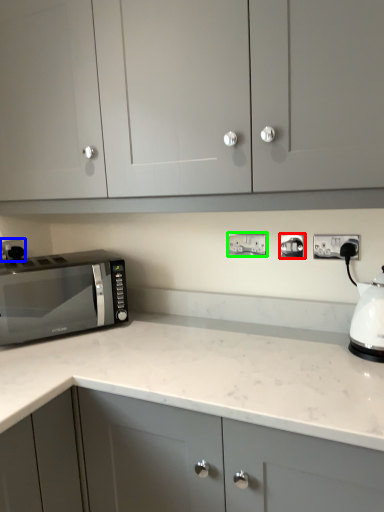
Question: Which is nearer to the electric outlet (highlighted by a red box)? electric outlet (highlighted by a blue box) or electric outlet (highlighted by a green box).

Choices:
 (A) electric outlet
 (B) electric outlet

Answer: (B)